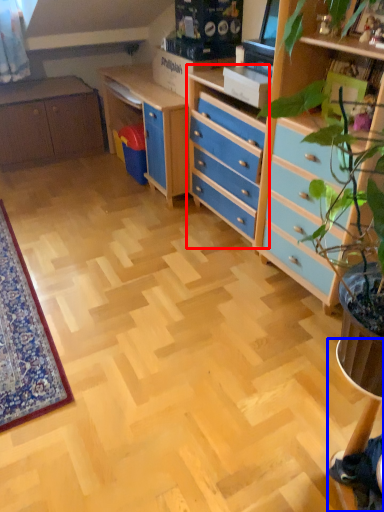
Question: Among these objects, which one is farthest to the camera, chest of drawers (highlighted by a red box) or computer desk (highlighted by a blue box)?

Choices:
 (A) chest of drawers
 (B) computer desk

Answer: (A)